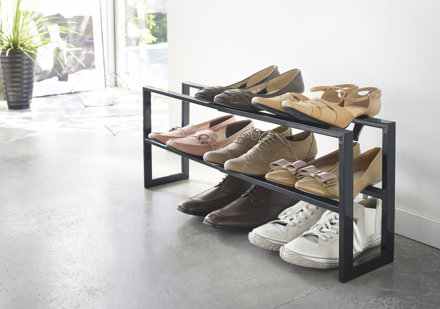
The width and height of the screenshot is (440, 309). In order to click on shoe on the floor in this screenshot , I will do `click(220, 192)`, `click(242, 205)`, `click(275, 226)`, `click(313, 242)`.